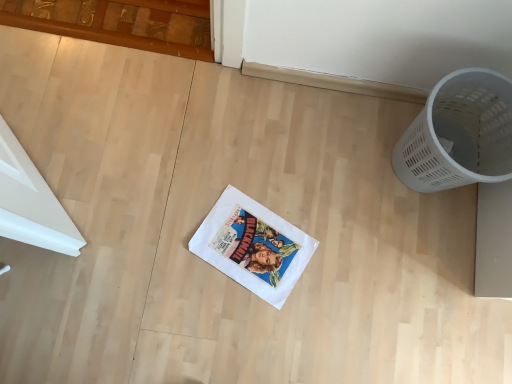
Locate an element on the screen. The width and height of the screenshot is (512, 384). vacant space in front of white paper comic book at center is located at coordinates (225, 328).